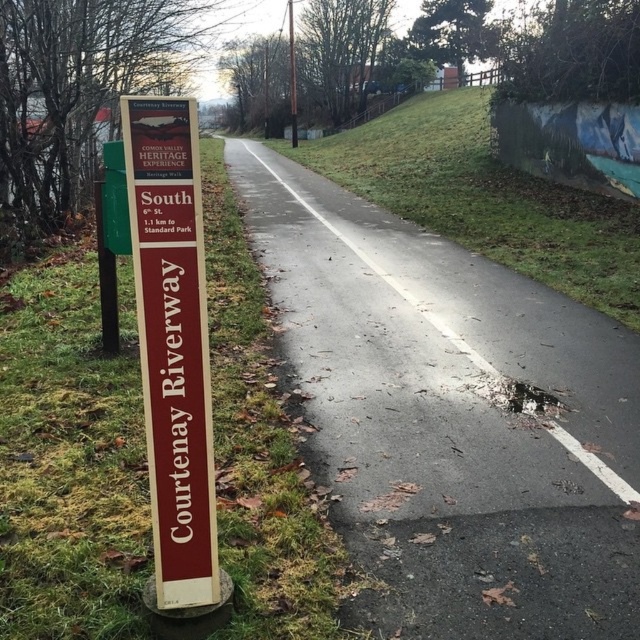
Question: Is the position of green grass at center more distant than that of maroon wood sign at left?

Choices:
 (A) yes
 (B) no

Answer: (A)

Question: Which of these objects is positioned farthest from the green grass at left?

Choices:
 (A) maroon wood sign at left
 (B) green grass at center
 (C) green plastic signpost at left

Answer: (B)

Question: Estimate the real-world distances between objects in this image. Which object is farther from the green grass at left?

Choices:
 (A) green grass at center
 (B) maroon wood sign at left
 (C) green plastic signpost at left

Answer: (A)

Question: Which object is closer to the camera taking this photo?

Choices:
 (A) green grass at left
 (B) maroon wood sign at left

Answer: (B)

Question: In this image, where is maroon wood sign at left located relative to green plastic signpost at left?

Choices:
 (A) left
 (B) right

Answer: (B)

Question: Does green grass at center have a lesser width compared to maroon wood sign at left?

Choices:
 (A) yes
 (B) no

Answer: (B)